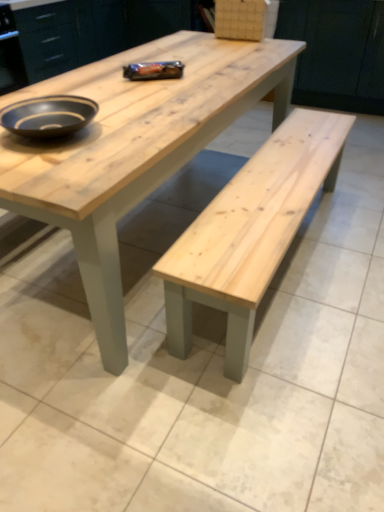
Question: Is matte black bowl at upper left beside natural wood bench at center?

Choices:
 (A) yes
 (B) no

Answer: (B)

Question: Is matte black bowl at upper left bigger than natural wood bench at center?

Choices:
 (A) yes
 (B) no

Answer: (B)

Question: Does matte black bowl at upper left have a smaller size compared to natural wood bench at center?

Choices:
 (A) no
 (B) yes

Answer: (B)

Question: Considering the relative positions of matte black bowl at upper left and natural wood bench at center in the image provided, is matte black bowl at upper left to the right of natural wood bench at center from the viewer's perspective?

Choices:
 (A) no
 (B) yes

Answer: (A)

Question: Is matte black bowl at upper left outside natural wood bench at center?

Choices:
 (A) yes
 (B) no

Answer: (A)

Question: Does point (165, 0) appear closer or farther from the camera than point (299, 31)?

Choices:
 (A) closer
 (B) farther

Answer: (B)

Question: Is natural wood cabinet at upper center, which is counted as the second cabinetry, starting from the right, in front of or behind matte wood cabinet at upper center, the first cabinetry when ordered from right to left, in the image?

Choices:
 (A) behind
 (B) front

Answer: (B)

Question: In terms of height, does natural wood cabinet at upper center, which is counted as the second cabinetry, starting from the right, look taller or shorter compared to matte wood cabinet at upper center, which ranks as the second cabinetry in left-to-right order?

Choices:
 (A) tall
 (B) short

Answer: (B)

Question: In terms of size, does natural wood cabinet at upper center, which is counted as the second cabinetry, starting from the right, appear bigger or smaller than matte wood cabinet at upper center, the first cabinetry when ordered from right to left?

Choices:
 (A) small
 (B) big

Answer: (B)

Question: Relative to matte black bowl at upper left, is matte wood cabinet at upper center, the first cabinetry when ordered from right to left, in front or behind?

Choices:
 (A) behind
 (B) front

Answer: (A)

Question: From their relative heights in the image, would you say matte wood cabinet at upper center, which ranks as the second cabinetry in left-to-right order, is taller or shorter than matte black bowl at upper left?

Choices:
 (A) short
 (B) tall

Answer: (B)

Question: From a real-world perspective, is matte wood cabinet at upper center, the first cabinetry when ordered from right to left, above or below matte black bowl at upper left?

Choices:
 (A) below
 (B) above

Answer: (A)

Question: Would you say matte wood cabinet at upper center, the first cabinetry when ordered from right to left, is to the left or to the right of matte black bowl at upper left in the picture?

Choices:
 (A) right
 (B) left

Answer: (A)

Question: From the image's perspective, is natural wood bench at center positioned above or below natural wood cabinet at upper center, marked as the 1th cabinetry in a left-to-right arrangement?

Choices:
 (A) above
 (B) below

Answer: (B)

Question: Is natural wood bench at center to the left or to the right of natural wood cabinet at upper center, marked as the 1th cabinetry in a left-to-right arrangement, in the image?

Choices:
 (A) right
 (B) left

Answer: (A)